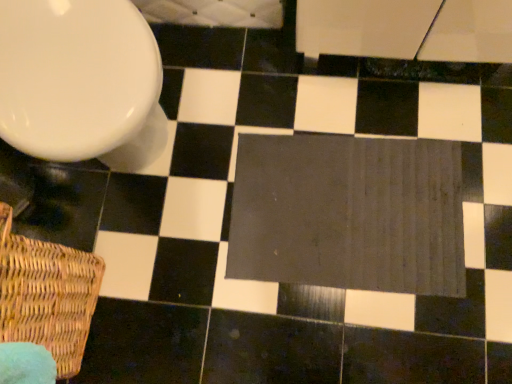
Describe the element at coordinates (81, 82) in the screenshot. I see `white glossy toilet at upper left` at that location.

Consider the image. Measure the distance between point (x=297, y=234) and camera.

Point (x=297, y=234) is 1.10 meters away from camera.

I want to click on white glossy toilet at upper left, so click(x=81, y=82).

From a real-world perspective, is woven brown basket at lower left positioned over dark gray fabric bath mat at center based on gravity?

Yes.

Which is closer to the camera, (75, 312) or (454, 163)?

Point (75, 312) is closer to the camera than point (454, 163).

From the image's perspective, which object appears higher, woven brown basket at lower left or dark gray fabric bath mat at center?

dark gray fabric bath mat at center appears higher in the image.

Which object is wider, woven brown basket at lower left or dark gray fabric bath mat at center?

With larger width is dark gray fabric bath mat at center.

Based on the photo, considering the positions of objects woven brown basket at lower left and white glossy toilet at upper left in the image provided, who is more to the right, woven brown basket at lower left or white glossy toilet at upper left?

Positioned to the right is white glossy toilet at upper left.

Can you confirm if woven brown basket at lower left is smaller than white glossy toilet at upper left?

Yes.

At what (x,y) coordinates should I click in order to perform the action: click on basket below the white glossy toilet at upper left (from a real-world perspective). Please return your answer as a coordinate pair (x, y). The height and width of the screenshot is (384, 512). Looking at the image, I should click on (47, 295).

Is dark gray fabric bath mat at center inside the boundaries of white glossy toilet at upper left, or outside?

dark gray fabric bath mat at center is not inside white glossy toilet at upper left, it's outside.

Between dark gray fabric bath mat at center and white glossy toilet at upper left, which one is positioned behind?

dark gray fabric bath mat at center.

Would you say dark gray fabric bath mat at center is a long distance from white glossy toilet at upper left?

Actually, dark gray fabric bath mat at center and white glossy toilet at upper left are a little close together.

Which object is positioned more to the left, dark gray fabric bath mat at center or white glossy toilet at upper left?

white glossy toilet at upper left is more to the left.

In the image, is white glossy toilet at upper left on the left side or the right side of dark gray fabric bath mat at center?

Clearly, white glossy toilet at upper left is on the left of dark gray fabric bath mat at center in the image.

Can you confirm if white glossy toilet at upper left is taller than dark gray fabric bath mat at center?

Correct, white glossy toilet at upper left is much taller as dark gray fabric bath mat at center.

From a real-world perspective, is white glossy toilet at upper left over dark gray fabric bath mat at center?

Yes, from a real-world perspective, white glossy toilet at upper left is over dark gray fabric bath mat at center

Which is nearer, (106, 89) or (361, 265)?

Positioned in front is point (106, 89).

Is dark gray fabric bath mat at center inside or outside of woven brown basket at lower left?

dark gray fabric bath mat at center lies outside woven brown basket at lower left.

Is dark gray fabric bath mat at center at the left side of woven brown basket at lower left?

Incorrect, dark gray fabric bath mat at center is not on the left side of woven brown basket at lower left.

Which is behind, dark gray fabric bath mat at center or woven brown basket at lower left?

dark gray fabric bath mat at center is further from the camera.

Considering the points (286, 220) and (75, 271), which point is behind, point (286, 220) or point (75, 271)?

The point (286, 220) is farther.

Is the position of white glossy toilet at upper left more distant than that of woven brown basket at lower left?

No, white glossy toilet at upper left is closer to the camera.

Considering the sizes of white glossy toilet at upper left and woven brown basket at lower left in the image, is white glossy toilet at upper left bigger or smaller than woven brown basket at lower left?

In the image, white glossy toilet at upper left appears to be larger than woven brown basket at lower left.

Is white glossy toilet at upper left not close to woven brown basket at lower left?

That's not correct — white glossy toilet at upper left is a little close to woven brown basket at lower left.

Where is `toilet in front of the woven brown basket at lower left`? This screenshot has height=384, width=512. toilet in front of the woven brown basket at lower left is located at coordinates (81, 82).

Locate an element on the screen. The height and width of the screenshot is (384, 512). basket on the left of the dark gray fabric bath mat at center is located at coordinates 47,295.

Where is `toilet on the right side of woven brown basket at lower left`? This screenshot has height=384, width=512. toilet on the right side of woven brown basket at lower left is located at coordinates (81, 82).

From the image, which object appears to be nearer to white glossy toilet at upper left, dark gray fabric bath mat at center or woven brown basket at lower left?

woven brown basket at lower left is closer to white glossy toilet at upper left.

Which object lies nearer to the anchor point woven brown basket at lower left, white glossy toilet at upper left or dark gray fabric bath mat at center?

Among the two, white glossy toilet at upper left is located nearer to woven brown basket at lower left.

Based on their spatial positions, is dark gray fabric bath mat at center or white glossy toilet at upper left further from woven brown basket at lower left?

Among the two, dark gray fabric bath mat at center is located further to woven brown basket at lower left.

From the image, which object appears to be farther from white glossy toilet at upper left, woven brown basket at lower left or dark gray fabric bath mat at center?

The object further to white glossy toilet at upper left is dark gray fabric bath mat at center.

Considering their positions, is woven brown basket at lower left positioned closer to dark gray fabric bath mat at center than white glossy toilet at upper left?

Based on the image, white glossy toilet at upper left appears to be nearer to dark gray fabric bath mat at center.

Looking at the image, which one is located further to dark gray fabric bath mat at center, white glossy toilet at upper left or woven brown basket at lower left?

The object further to dark gray fabric bath mat at center is woven brown basket at lower left.

The width and height of the screenshot is (512, 384). In order to click on toilet between woven brown basket at lower left and dark gray fabric bath mat at center in this screenshot , I will do `click(81, 82)`.